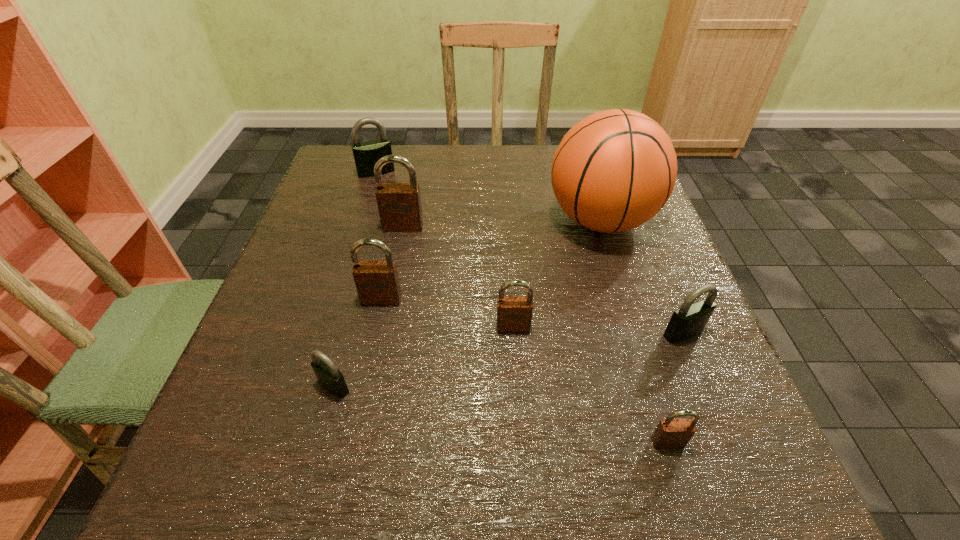
This screenshot has width=960, height=540. What are the coordinates of `the fourth object from right to left` in the screenshot? It's located at (514, 313).

Where is `the second nearest padlock`? the second nearest padlock is located at coordinates (329, 377).

Where is `the nearest black padlock`? The width and height of the screenshot is (960, 540). the nearest black padlock is located at coordinates (329, 377).

The image size is (960, 540). Identify the location of the nearest brown padlock. (670, 433).

Locate an element on the screen. the second padlock from right to left is located at coordinates (670, 433).

At what (x,y) coordinates should I click in order to perform the action: click on free space located on the left of the basketball. Please return your answer as a coordinate pair (x, y). This screenshot has height=540, width=960. Looking at the image, I should click on (459, 220).

Image resolution: width=960 pixels, height=540 pixels. Identify the location of free space located 0.370m on the front-facing side of the biggest brown padlock. (373, 375).

Locate an element on the screen. The width and height of the screenshot is (960, 540). vacant space situated on the front of the farthest padlock is located at coordinates (358, 232).

I want to click on free point located on the front-facing side of the third smallest brown padlock, so click(x=372, y=345).

Find the location of `blank space located 0.270m on the left of the second farthest black padlock`. blank space located 0.270m on the left of the second farthest black padlock is located at coordinates (510, 333).